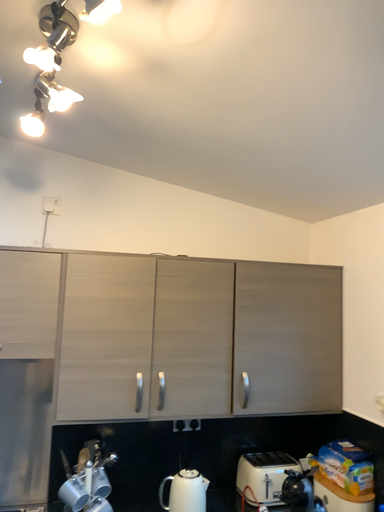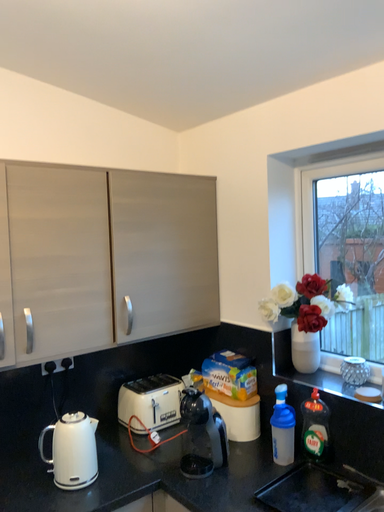
Question: Which way did the camera rotate in the video?

Choices:
 (A) rotated downward
 (B) rotated upward

Answer: (A)